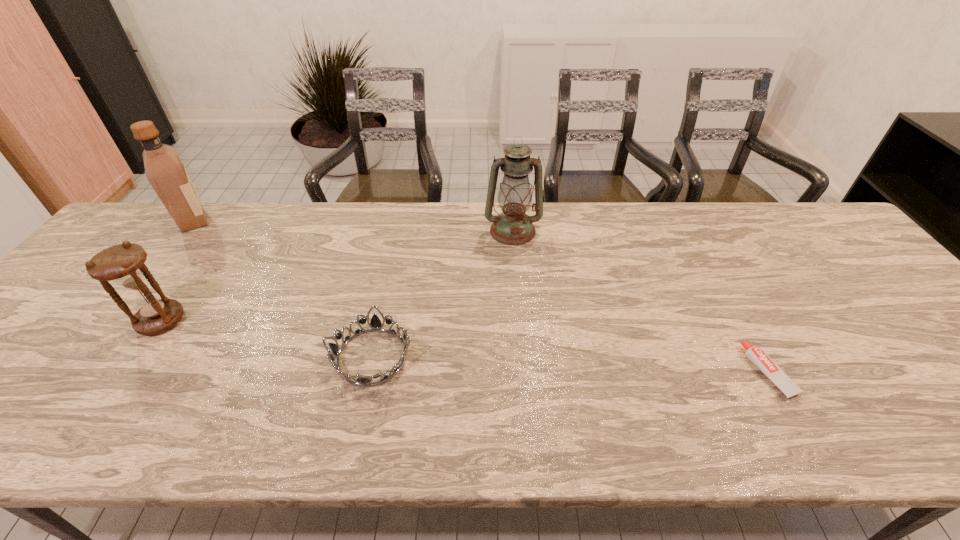
The image size is (960, 540). In order to click on empty space between the liquor and the third object from right to left in this screenshot , I will do `click(282, 288)`.

This screenshot has width=960, height=540. I want to click on free space between the third tallest object and the fourth object from left to right, so click(337, 275).

Find the location of a particular element. vacant space that is in between the hourglass and the fourth tallest object is located at coordinates (266, 339).

Where is `free space between the fourth tallest object and the shortest object`? The image size is (960, 540). free space between the fourth tallest object and the shortest object is located at coordinates (570, 364).

I want to click on vacant area that lies between the fourth tallest object and the liquor, so click(x=282, y=288).

Locate an element on the screen. free area in between the rightmost object and the third tallest object is located at coordinates (465, 346).

Identify the location of vacant area that lies between the third tallest object and the liquor. The image size is (960, 540). (177, 270).

Identify the location of unoccupied area between the tiara and the liquor. (282, 288).

The height and width of the screenshot is (540, 960). What are the coordinates of `free space between the oil lamp and the shortest object` in the screenshot? It's located at 640,301.

Choose which object is the nearest neighbor to the third tallest object. Please provide its 2D coordinates. Your answer should be formatted as a tuple, i.e. [(x, y)], where the tuple contains the x and y coordinates of a point satisfying the conditions above.

[(164, 169)]